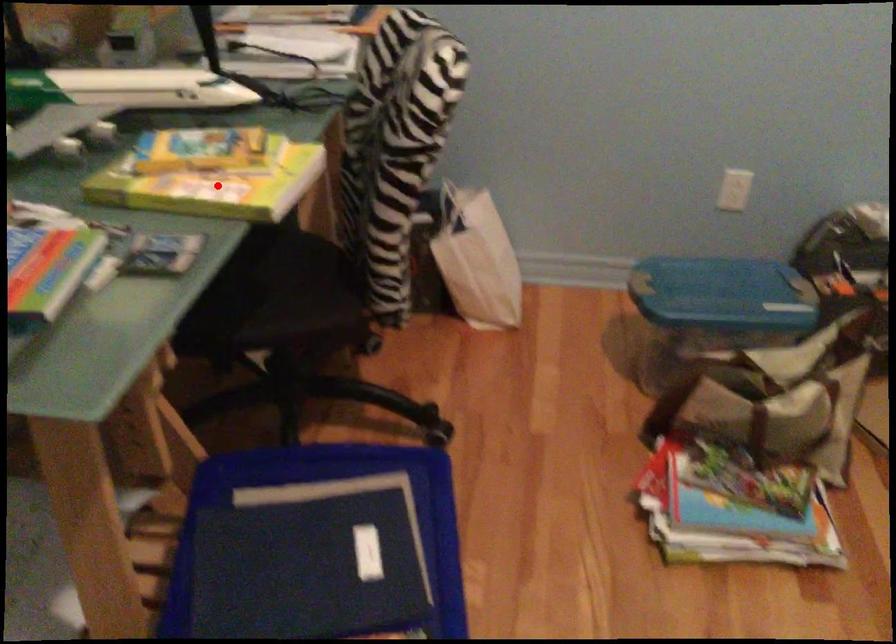
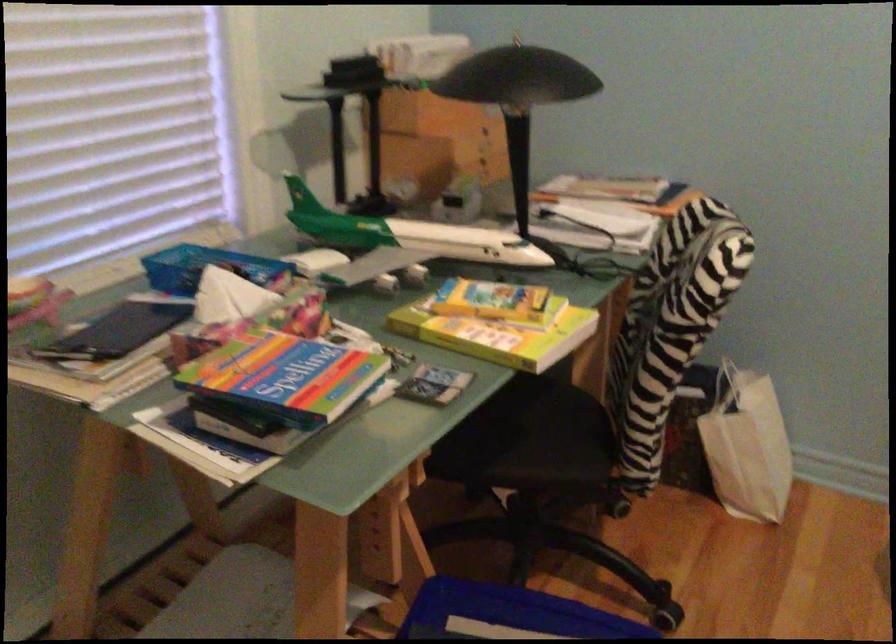
Question: I am providing you with two images of the same scene from different viewpoints. A red point is marked on the first image. At the location where the point appears in image 1, is it still visible in image 2?

Choices:
 (A) Yes
 (B) No

Answer: (A)